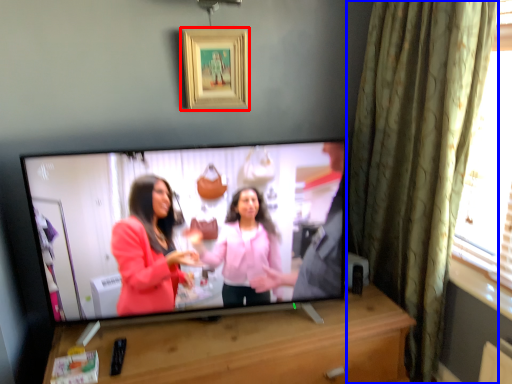
Question: Which point is further to the camera, picture frame (highlighted by a red box) or curtain (highlighted by a blue box)?

Choices:
 (A) picture frame
 (B) curtain

Answer: (A)